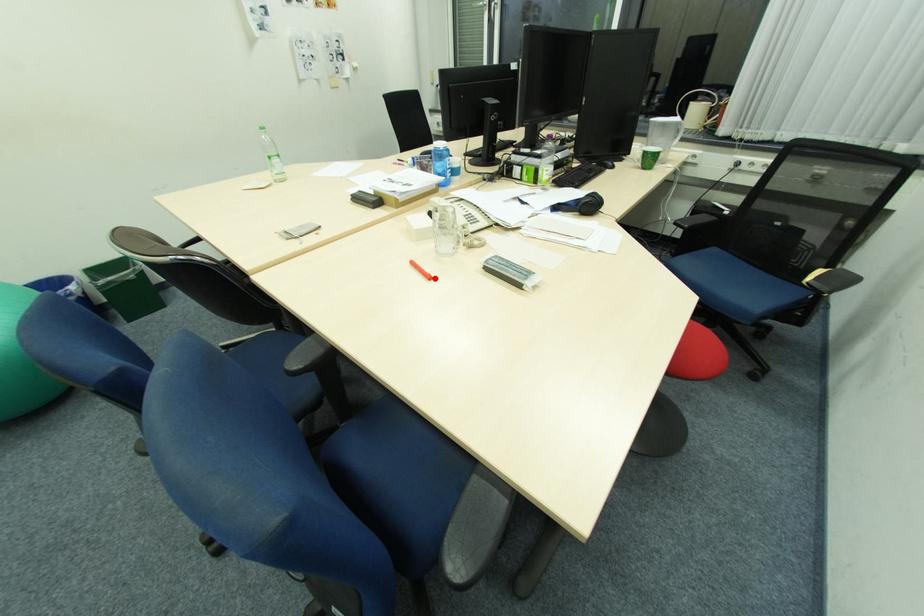
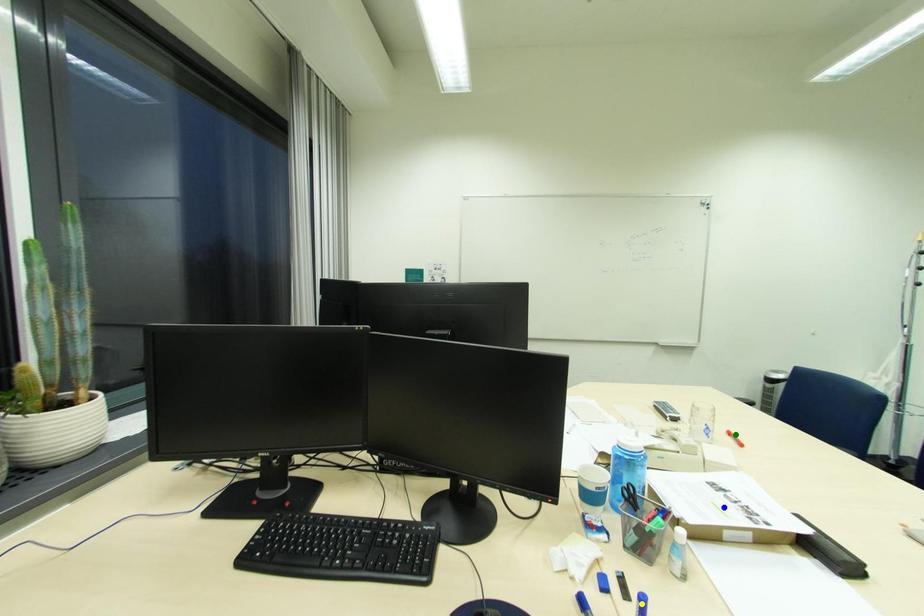
Question: I am providing you with two images of the same scene from different viewpoints. A red point is marked on the first image. You are given multiple points on the second image. Which point in image 2 is actually the same real-world point as the red point in image 1?

Choices:
 (A) blue point
 (B) yellow point
 (C) green point

Answer: (C)